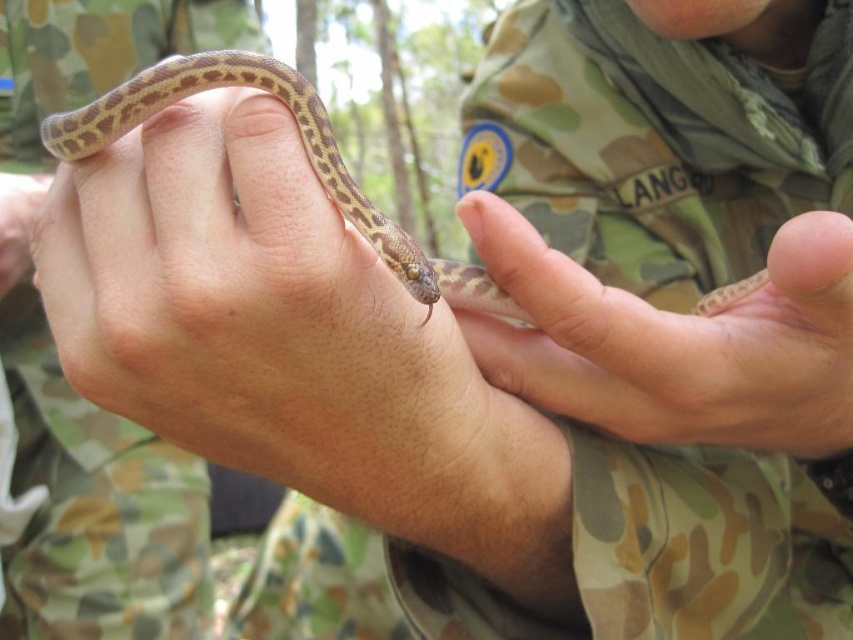
Is brown matte snake at center below brown spotted skin at center?

Yes.

Measure the distance from brown matte snake at center to brown spotted skin at center.

brown matte snake at center is 6.64 centimeters away from brown spotted skin at center.

Who is more forward, (84, 330) or (142, 106)?

Point (84, 330) is in front.

You are a GUI agent. You are given a task and a screenshot of the screen. Output one action in this format:
    pyautogui.click(x=<x>, y=<y>)
    Task: Click on the brown matte snake at center
    The height and width of the screenshot is (640, 853).
    Given the screenshot: What is the action you would take?
    207,282

Looking at this image, between brown matte snake at center and smooth skin hand at center, which one is positioned higher?

brown matte snake at center

Is point (175, 308) farther from viewer compared to point (828, 346)?

No, it is in front of (828, 346).

Find the location of a particular element. brown matte snake at center is located at coordinates (207, 282).

Does smooth skin hand at center appear on the right side of brown spotted skin at center?

Indeed, smooth skin hand at center is positioned on the right side of brown spotted skin at center.

Which is below, smooth skin hand at center or brown spotted skin at center?

smooth skin hand at center

Where is `smooth skin hand at center`? This screenshot has width=853, height=640. smooth skin hand at center is located at coordinates (675, 342).

At what (x,y) coordinates should I click in order to perform the action: click on smooth skin hand at center. Please return your answer as a coordinate pair (x, y). This screenshot has height=640, width=853. Looking at the image, I should click on (675, 342).